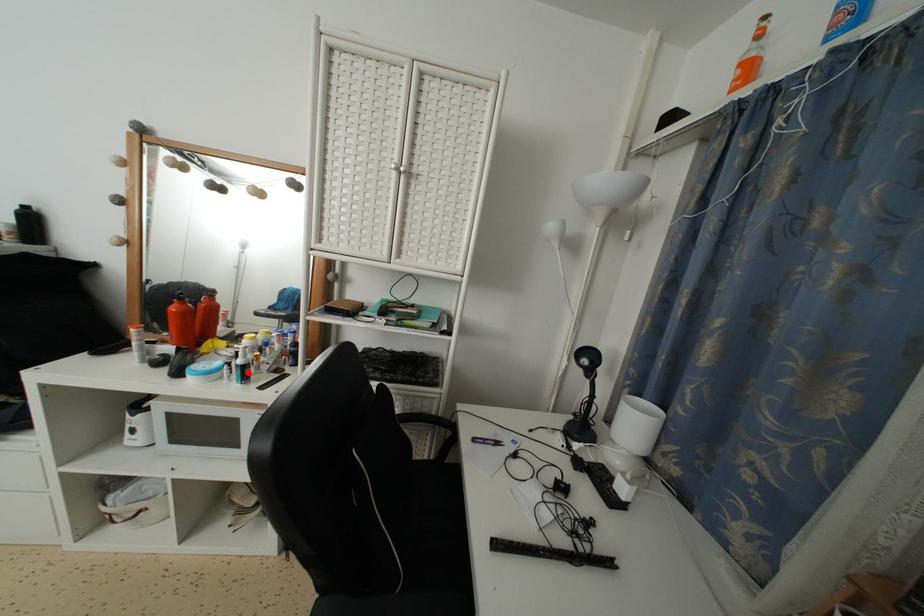
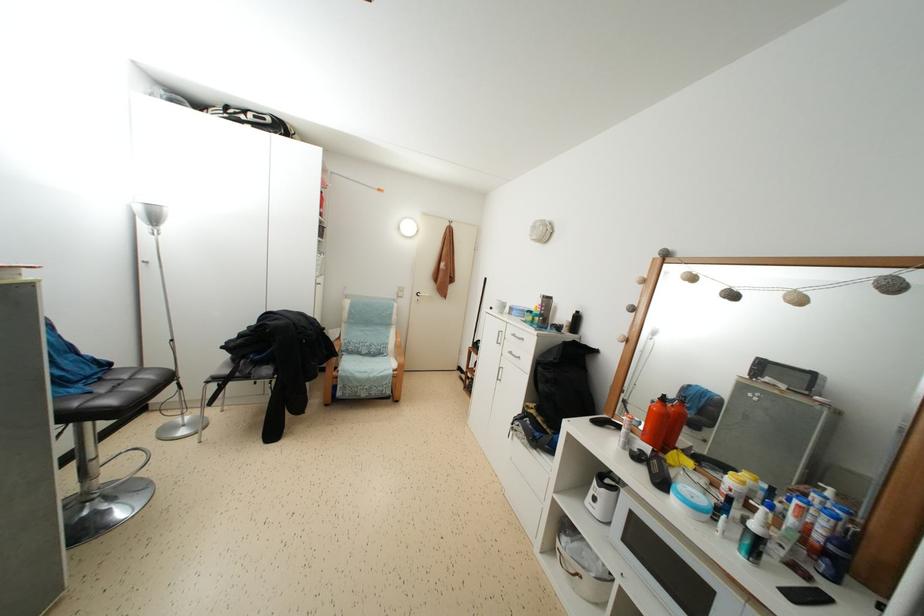
The point at the highlighted location is marked in the first image. Where is the corresponding point in the second image?

(763, 546)